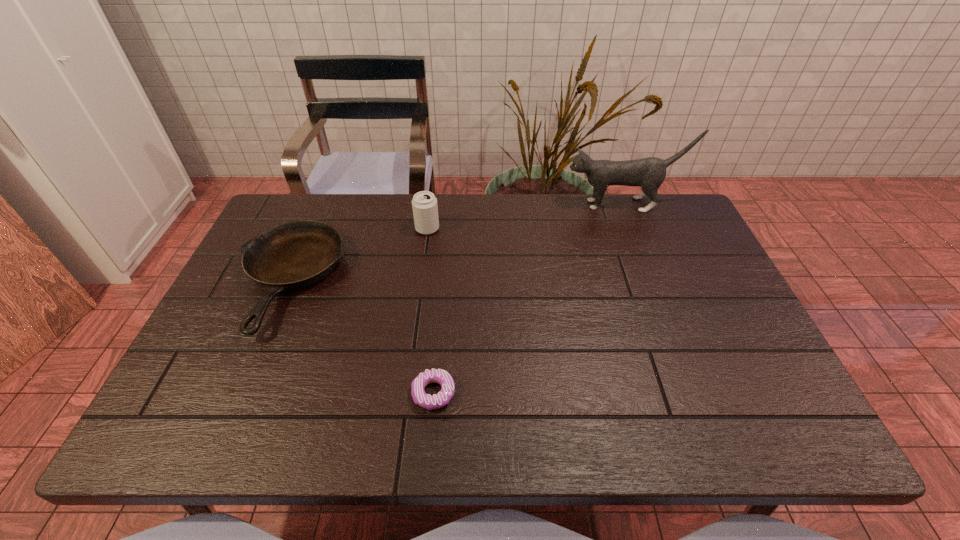
The width and height of the screenshot is (960, 540). Find the location of `the farthest object`. the farthest object is located at coordinates (649, 173).

Locate an element on the screen. cat is located at coordinates (649, 173).

This screenshot has height=540, width=960. Identify the location of the second tallest object. (424, 204).

I want to click on the third tallest object, so tap(294, 255).

At what (x,y) coordinates should I click in order to perform the action: click on frying pan. Please return your answer as a coordinate pair (x, y). Looking at the image, I should click on (294, 255).

Locate an element on the screen. doughnut is located at coordinates (442, 377).

Find the location of a particular element. The image size is (960, 540). the shortest object is located at coordinates (442, 377).

I want to click on free space located 0.080m at the face of the cat, so click(540, 205).

At what (x,y) coordinates should I click in order to perform the action: click on vacant space located 0.210m at the face of the cat. Please return your answer as a coordinate pair (x, y). The image size is (960, 540). Looking at the image, I should click on (500, 205).

Where is `free space located 0.370m at the face of the cat`? free space located 0.370m at the face of the cat is located at coordinates (451, 205).